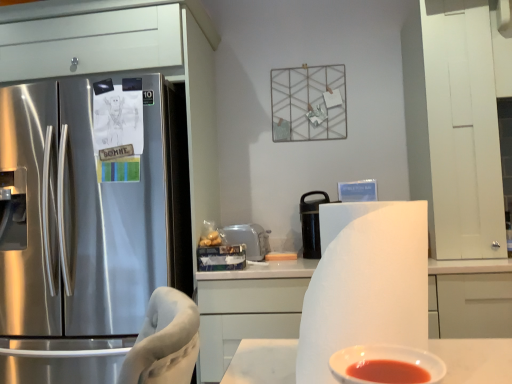
Question: Is white plastic toaster at center, which ranks as the first appliance in left-to-right order, positioned far away from black matte thermos at center, which is counted as the 1th appliance, starting from the right?

Choices:
 (A) yes
 (B) no

Answer: (B)

Question: Is white plastic toaster at center, which ranks as the second appliance in right-to-left order, surrounding black matte thermos at center, which is counted as the 2th appliance, starting from the left?

Choices:
 (A) no
 (B) yes

Answer: (A)

Question: Is white plastic toaster at center, which ranks as the first appliance in left-to-right order, facing away from black matte thermos at center, which is counted as the 2th appliance, starting from the left?

Choices:
 (A) yes
 (B) no

Answer: (B)

Question: From the image's perspective, would you say white plastic toaster at center, which ranks as the second appliance in right-to-left order, is shown under black matte thermos at center, which is counted as the 1th appliance, starting from the right?

Choices:
 (A) yes
 (B) no

Answer: (A)

Question: Does white plastic toaster at center, which ranks as the first appliance in left-to-right order, appear on the left side of black matte thermos at center, which is counted as the 1th appliance, starting from the right?

Choices:
 (A) no
 (B) yes

Answer: (B)

Question: Considering the relative sizes of white plastic toaster at center, which ranks as the second appliance in right-to-left order, and black matte thermos at center, which is counted as the 1th appliance, starting from the right, in the image provided, is white plastic toaster at center, which ranks as the second appliance in right-to-left order, wider than black matte thermos at center, which is counted as the 1th appliance, starting from the right,?

Choices:
 (A) yes
 (B) no

Answer: (A)

Question: From the image's perspective, would you say white matte cabinet at center is positioned over black matte thermos at center, which is counted as the 2th appliance, starting from the left?

Choices:
 (A) yes
 (B) no

Answer: (B)

Question: Is white matte cabinet at center not within black matte thermos at center, which is counted as the 2th appliance, starting from the left?

Choices:
 (A) yes
 (B) no

Answer: (A)

Question: From the image's perspective, is white matte cabinet at center located beneath black matte thermos at center, which is counted as the 1th appliance, starting from the right?

Choices:
 (A) yes
 (B) no

Answer: (A)

Question: Could black matte thermos at center, which is counted as the 2th appliance, starting from the left, be considered to be inside white matte cabinet at center?

Choices:
 (A) no
 (B) yes

Answer: (A)

Question: From a real-world perspective, is white matte cabinet at center positioned under black matte thermos at center, which is counted as the 1th appliance, starting from the right, based on gravity?

Choices:
 (A) yes
 (B) no

Answer: (A)

Question: Is white matte cabinet at center thinner than black matte thermos at center, which is counted as the 2th appliance, starting from the left?

Choices:
 (A) no
 (B) yes

Answer: (A)

Question: Is white matte paper towel at center wider than white plastic toaster at center, which ranks as the first appliance in left-to-right order?

Choices:
 (A) no
 (B) yes

Answer: (A)